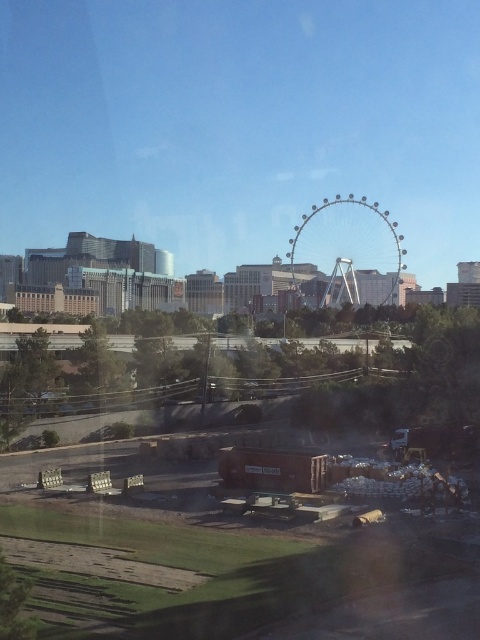
Question: Which object appears closest to the camera in this image?

Choices:
 (A) metallic silver ferris wheel at center
 (B) brown wooden pallets at lower left

Answer: (B)

Question: Does brown wooden pallets at lower left appear on the right side of metallic silver ferris wheel at center?

Choices:
 (A) yes
 (B) no

Answer: (B)

Question: Among these points, which one is nearest to the camera?

Choices:
 (A) pyautogui.click(x=393, y=228)
 (B) pyautogui.click(x=300, y=426)

Answer: (B)

Question: Is brown wooden pallets at lower left below metallic silver ferris wheel at center?

Choices:
 (A) yes
 (B) no

Answer: (A)

Question: Does brown wooden pallets at lower left lie behind metallic silver ferris wheel at center?

Choices:
 (A) no
 (B) yes

Answer: (A)